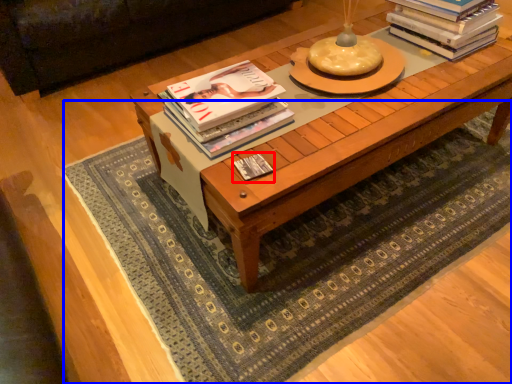
Question: Which of the following is the farthest to the observer, book (highlighted by a red box) or mat (highlighted by a blue box)?

Choices:
 (A) book
 (B) mat

Answer: (A)